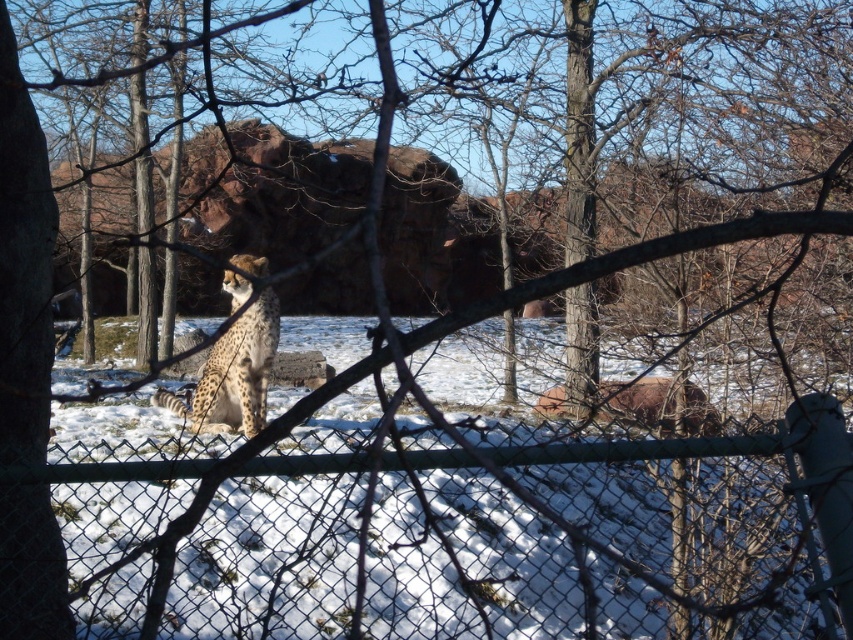
Question: Among these objects, which one is farthest from the camera?

Choices:
 (A) green chain-link fence at center
 (B) spotted fur cheetah at center

Answer: (B)

Question: Does green chain-link fence at center appear on the right side of spotted fur cheetah at center?

Choices:
 (A) no
 (B) yes

Answer: (B)

Question: Is green chain-link fence at center positioned in front of spotted fur cheetah at center?

Choices:
 (A) no
 (B) yes

Answer: (B)

Question: Which object appears closest to the camera in this image?

Choices:
 (A) green chain-link fence at center
 (B) spotted fur cheetah at center

Answer: (A)

Question: Does green chain-link fence at center have a smaller size compared to spotted fur cheetah at center?

Choices:
 (A) yes
 (B) no

Answer: (B)